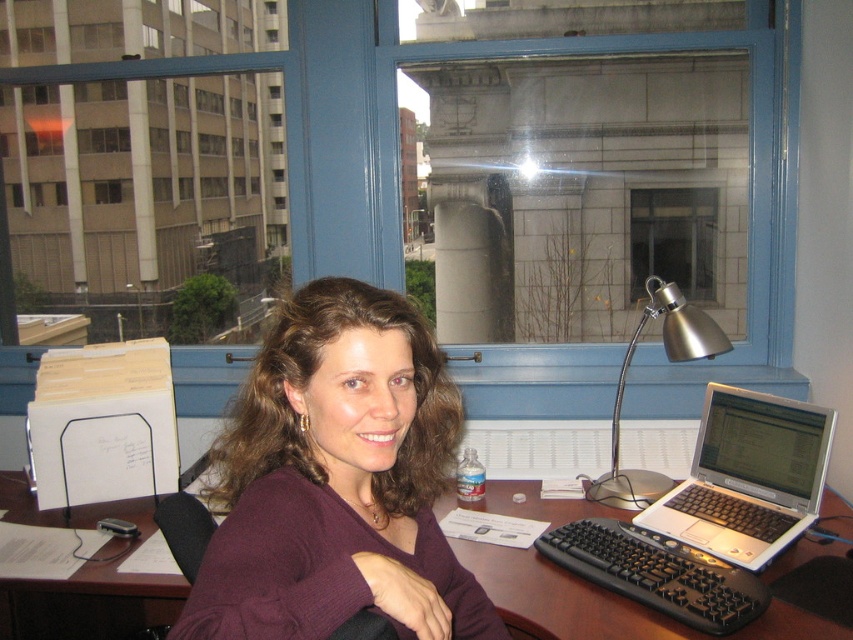
Question: Can you confirm if silver metallic laptop at right is wider than clear glass window at center?

Choices:
 (A) no
 (B) yes

Answer: (B)

Question: Is clear glass window at center thinner than satin silver desk lamp at right?

Choices:
 (A) no
 (B) yes

Answer: (B)

Question: Estimate the real-world distances between objects in this image. Which object is farther from the silver metallic laptop at right?

Choices:
 (A) brown wooden table at center
 (B) black plastic keyboard at lower center

Answer: (B)

Question: Which point is farther to the camera?

Choices:
 (A) (668, 227)
 (B) (701, 488)
 (C) (677, 340)
 (D) (20, 627)

Answer: (A)

Question: Is silver metallic laptop at right behind clear glass window at center?

Choices:
 (A) no
 (B) yes

Answer: (A)

Question: Based on their relative distances, which object is farther from the satin silver desk lamp at right?

Choices:
 (A) brown wooden table at center
 (B) clear glass window at center

Answer: (A)